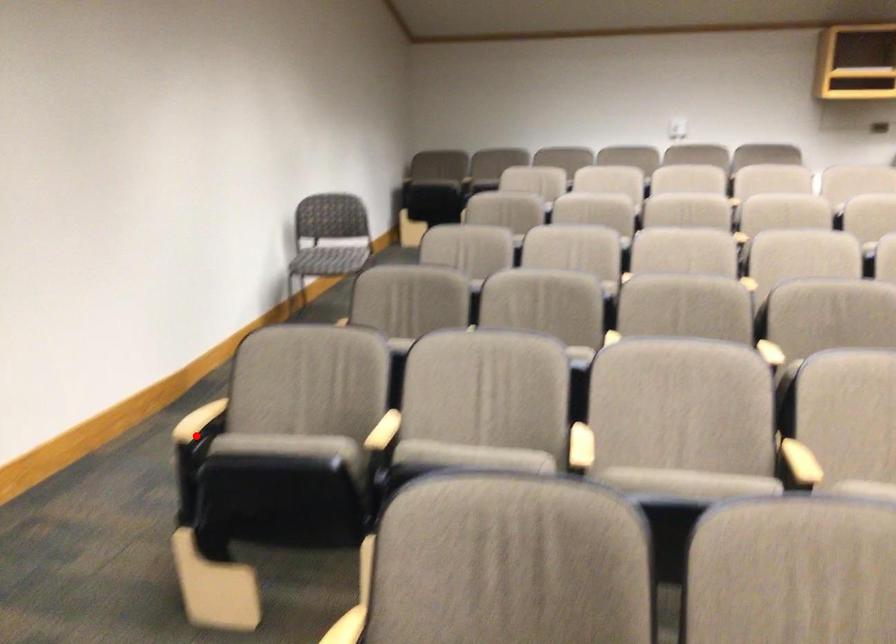
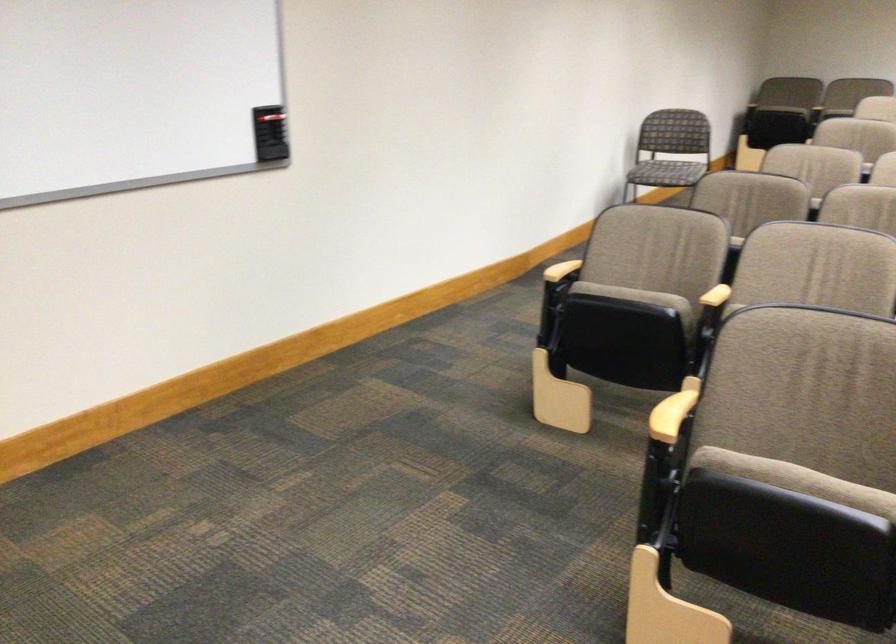
In the second image, find the point that corresponds to the highlighted location in the first image.

(561, 269)